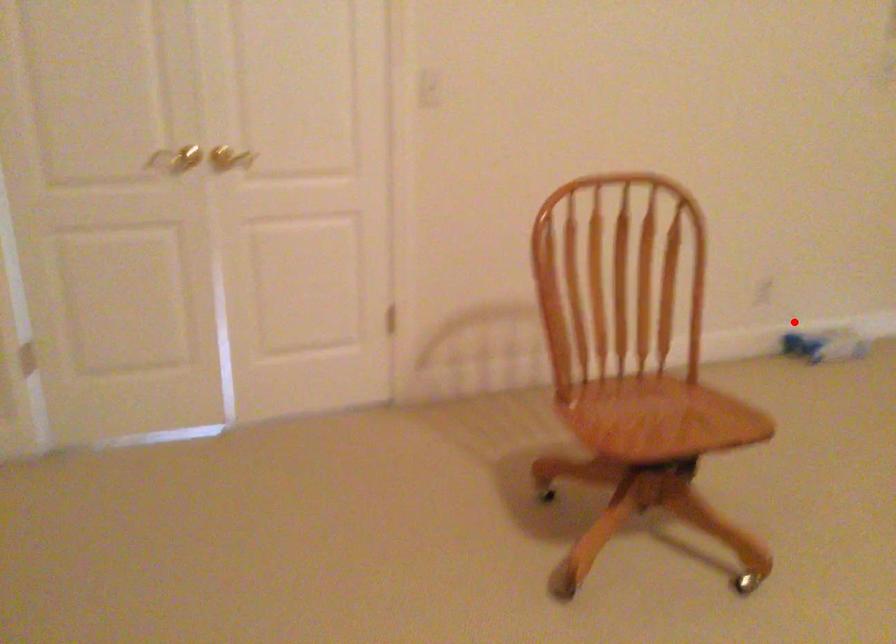
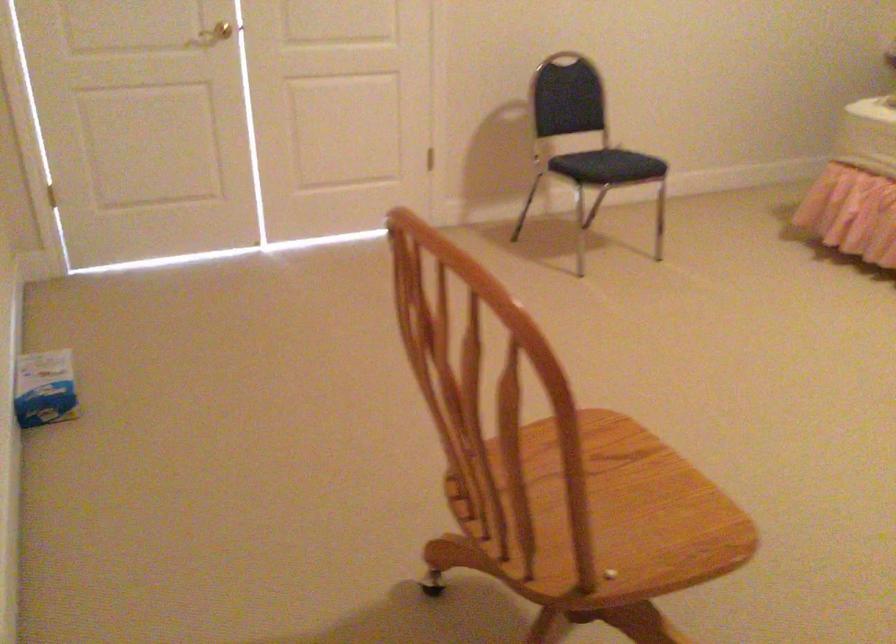
Where in the second image is the point corresponding to the highlighted location from the first image?

(45, 388)